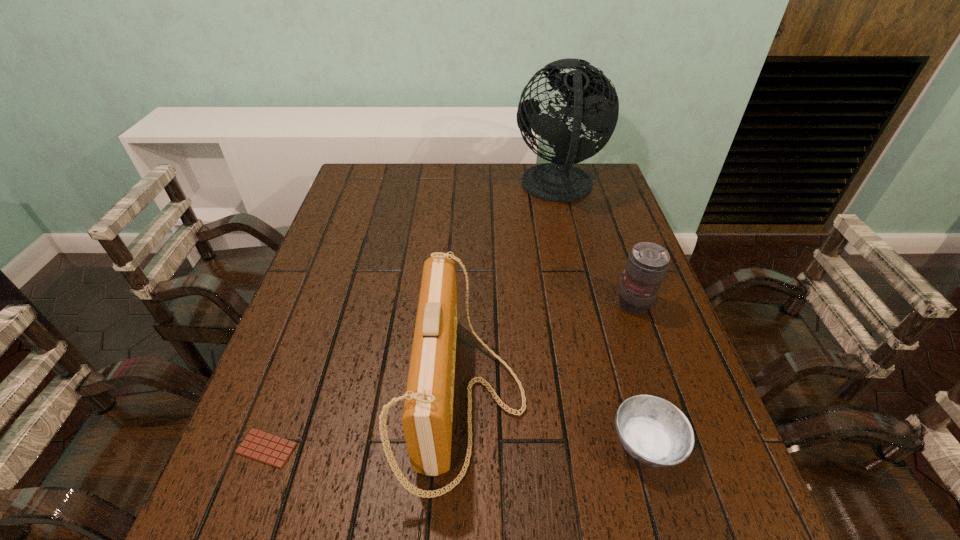
You are a GUI agent. You are given a task and a screenshot of the screen. Output one action in this format:
    pyautogui.click(x=<x>, y=<y>)
    Task: Click on the vacant region located on the front-facing side of the farthest object
    The image size is (960, 540).
    Given the screenshot: What is the action you would take?
    (478, 188)

At what (x,y) coordinates should I click in order to perform the action: click on blank area located on the front-facing side of the farthest object. Please return your answer as a coordinate pair (x, y). The height and width of the screenshot is (540, 960). Looking at the image, I should click on (451, 188).

I want to click on free space located on the decorative side of the second tallest object, so click(617, 399).

You are a GUI agent. You are given a task and a screenshot of the screen. Output one action in this format:
    pyautogui.click(x=<x>, y=<y>)
    Task: Click on the vacant point located on the side of the telephoto lens where the control switches are located
    The image size is (960, 540).
    Given the screenshot: What is the action you would take?
    pyautogui.click(x=673, y=414)

Where is `free space located on the left of the second shortest object`? free space located on the left of the second shortest object is located at coordinates (510, 444).

Where is `free space located on the right of the candy bar`? The image size is (960, 540). free space located on the right of the candy bar is located at coordinates (504, 448).

What are the coordinates of `object positioned at the far edge` in the screenshot? It's located at (595, 103).

This screenshot has width=960, height=540. Identify the location of object that is at the left edge. (258, 445).

At what (x,y) coordinates should I click in order to perform the action: click on globe located at the right edge. Please return your answer as a coordinate pair (x, y). The height and width of the screenshot is (540, 960). Looking at the image, I should click on (595, 103).

Find the location of a particular element. telephoto lens situated at the right edge is located at coordinates (647, 264).